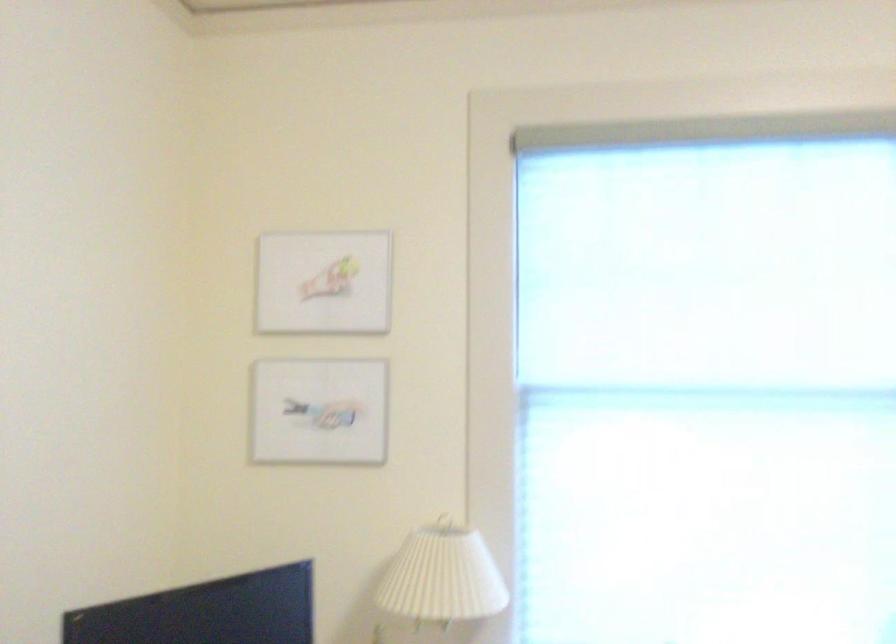
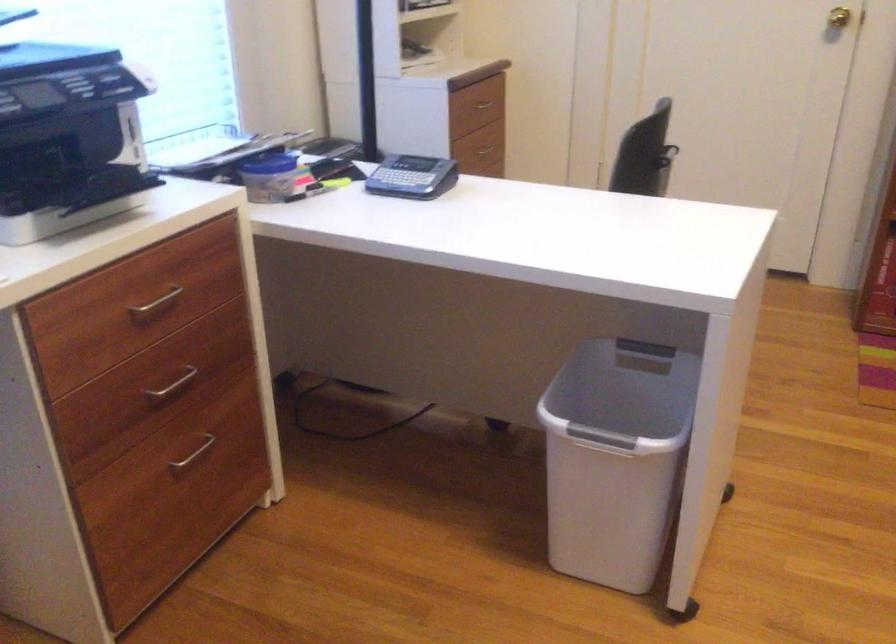
The first image is from the beginning of the video and the second image is from the end. How did the camera likely rotate when shooting the video?

The camera rotated toward right-down.